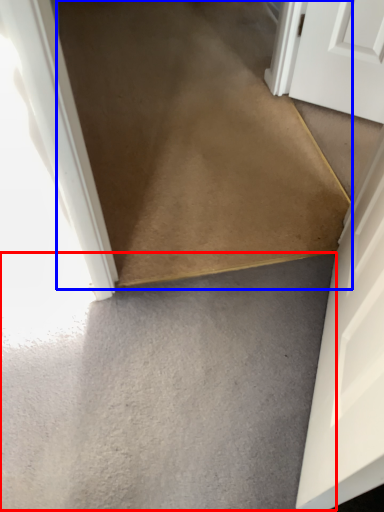
Question: Which object is closer to the camera taking this photo, concrete (highlighted by a red box) or path (highlighted by a blue box)?

Choices:
 (A) concrete
 (B) path

Answer: (A)